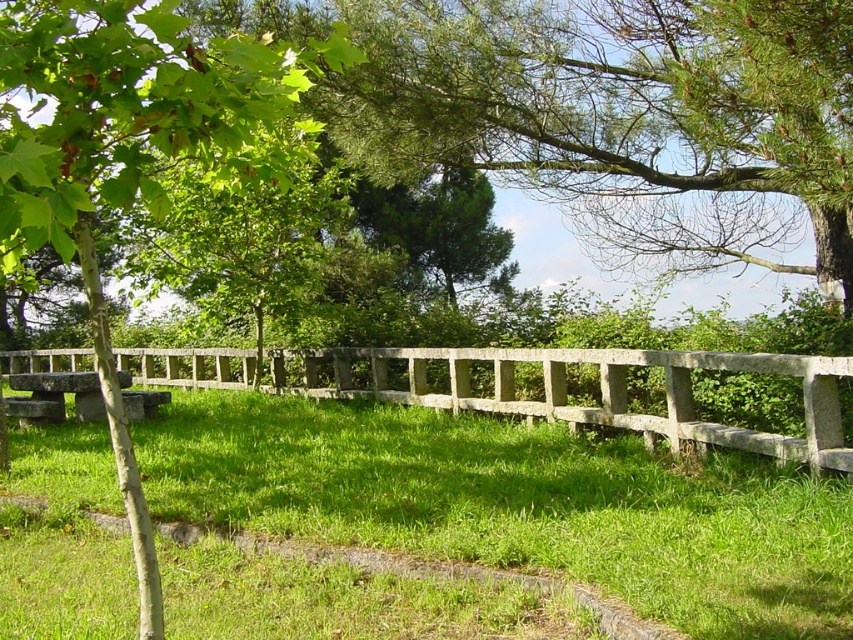
Can you confirm if green grassy at center is bigger than smooth gray stone bench at left?

Incorrect, green grassy at center is not larger than smooth gray stone bench at left.

Can you confirm if green grassy at center is positioned to the right of smooth gray stone bench at left?

Indeed, green grassy at center is positioned on the right side of smooth gray stone bench at left.

Where is `green grassy at center`? This screenshot has height=640, width=853. green grassy at center is located at coordinates (518, 502).

Where is `gray stone fence at center`? The width and height of the screenshot is (853, 640). gray stone fence at center is located at coordinates (577, 388).

Who is lower down, gray stone fence at center or smooth gray stone bench at left?

smooth gray stone bench at left is below.

Which is in front, point (537, 412) or point (141, 400)?

Point (537, 412) is in front.

Where is `gray stone fence at center`? The width and height of the screenshot is (853, 640). gray stone fence at center is located at coordinates (577, 388).

Which of these two, green leafy tree at left or smooth gray stone bench at left, stands shorter?

Standing shorter between the two is smooth gray stone bench at left.

Is green leafy tree at left further to the viewer compared to smooth gray stone bench at left?

No, it is not.

Locate an element on the screen. green leafy tree at left is located at coordinates (125, 152).